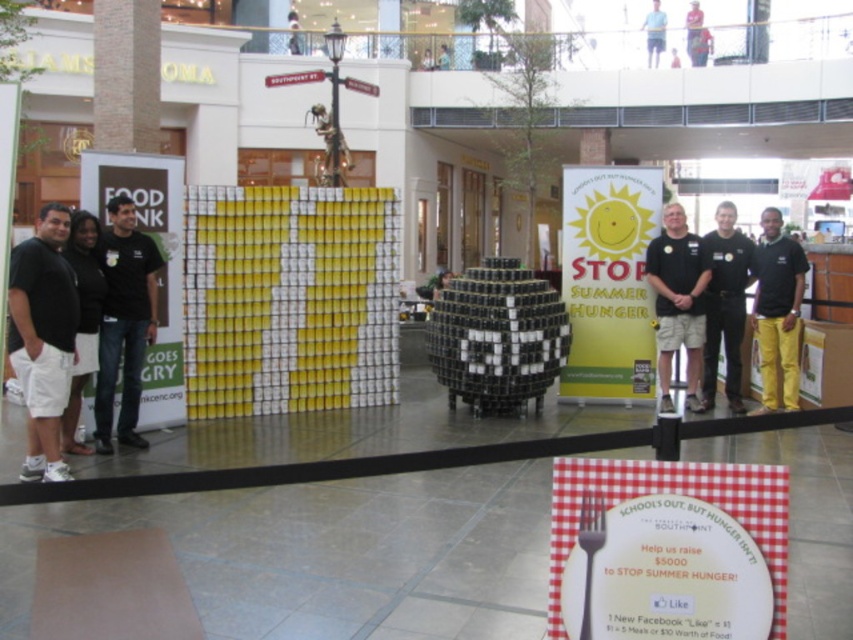
You are organizing a food donation event and need to place a name tag on the volunteer wearing the black cotton shirt at center. The name tag is attached to a silver metallic fork at center. Where should you place the name tag so that the shirt and fork are correctly positioned according to the scene?

The black cotton shirt at center should be positioned on the right side of the silver metallic fork at center, so place the name tag on the right side of the fork to maintain their correct spatial arrangement.